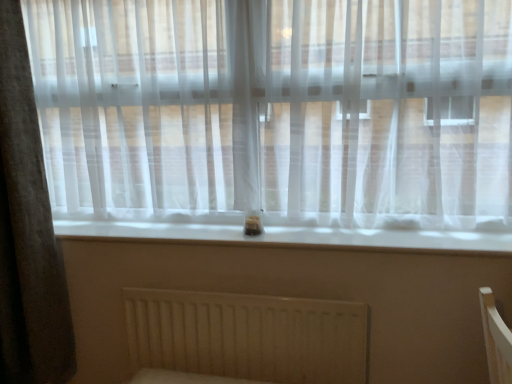
Question: From a real-world perspective, is gray fabric curtain at left physically above white matte radiator at lower center?

Choices:
 (A) yes
 (B) no

Answer: (A)

Question: Is white matte radiator at lower center at the back of gray fabric curtain at left?

Choices:
 (A) yes
 (B) no

Answer: (B)

Question: Can you confirm if gray fabric curtain at left is shorter than white matte radiator at lower center?

Choices:
 (A) no
 (B) yes

Answer: (A)

Question: Considering the relative sizes of gray fabric curtain at left and white matte radiator at lower center in the image provided, is gray fabric curtain at left taller than white matte radiator at lower center?

Choices:
 (A) no
 (B) yes

Answer: (B)

Question: From the image's perspective, does gray fabric curtain at left appear lower than white matte radiator at lower center?

Choices:
 (A) yes
 (B) no

Answer: (B)

Question: Can you confirm if gray fabric curtain at left is thinner than white matte radiator at lower center?

Choices:
 (A) yes
 (B) no

Answer: (B)

Question: Would you say white smooth window sill at center contains white matte radiator at lower center?

Choices:
 (A) no
 (B) yes

Answer: (A)

Question: Considering the relative positions of white smooth window sill at center and white matte radiator at lower center in the image provided, is white smooth window sill at center in front of white matte radiator at lower center?

Choices:
 (A) no
 (B) yes

Answer: (B)

Question: Can you confirm if white smooth window sill at center is wider than white matte radiator at lower center?

Choices:
 (A) yes
 (B) no

Answer: (A)

Question: Is white smooth window sill at center not within white matte radiator at lower center?

Choices:
 (A) yes
 (B) no

Answer: (A)

Question: From the image's perspective, is white smooth window sill at center over white matte radiator at lower center?

Choices:
 (A) yes
 (B) no

Answer: (A)

Question: From the image's perspective, is white smooth window sill at center located beneath white matte radiator at lower center?

Choices:
 (A) no
 (B) yes

Answer: (A)

Question: Considering the relative sizes of white matte radiator at lower center and gray fabric curtain at left in the image provided, is white matte radiator at lower center thinner than gray fabric curtain at left?

Choices:
 (A) yes
 (B) no

Answer: (A)